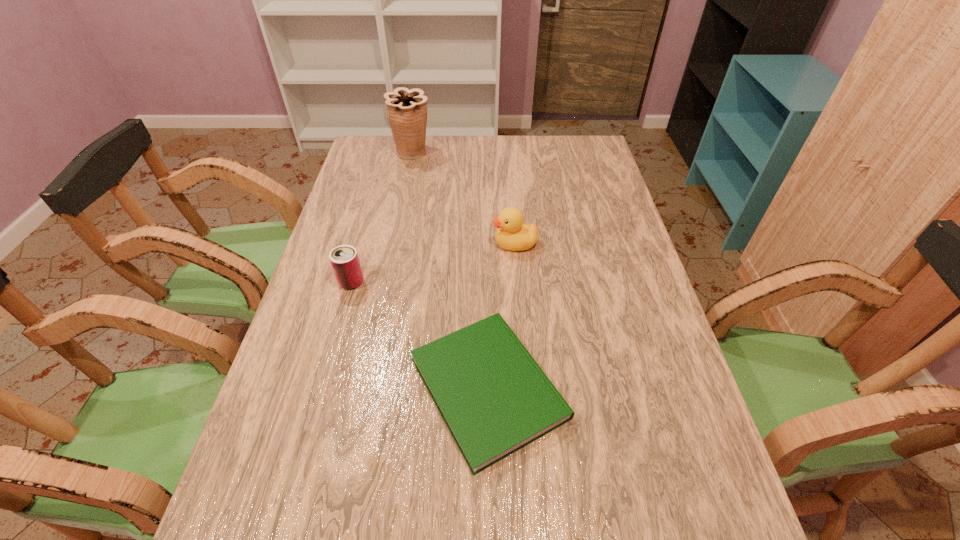
Find the location of `free space that is in between the urn and the third tallest object`. free space that is in between the urn and the third tallest object is located at coordinates (382, 217).

Locate an element on the screen. The height and width of the screenshot is (540, 960). empty space between the farthest object and the can is located at coordinates point(382,217).

Locate an element on the screen. the closest object to the urn is located at coordinates (512, 234).

Identify the location of object that is the closest to the farthest object. This screenshot has width=960, height=540. (512, 234).

Find the location of a particular element. The width and height of the screenshot is (960, 540). vacant space that satisfies the following two spatial constraints: 1. on the front side of the shortest object; 2. on the left side of the third farthest object is located at coordinates (322, 388).

Image resolution: width=960 pixels, height=540 pixels. Identify the location of free spot that satisfies the following two spatial constraints: 1. on the back side of the tallest object; 2. on the left side of the can. (387, 153).